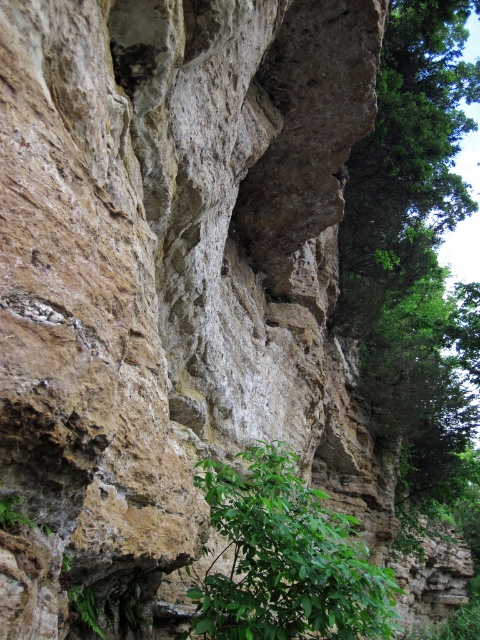
Does point (245, 580) come closer to viewer compared to point (382, 198)?

Yes, it is in front of point (382, 198).

Between green leafy plant at lower center and green leafy tree at upper right, which one has more height?

With more height is green leafy tree at upper right.

Does point (276, 637) lie in front of point (432, 3)?

Yes, point (276, 637) is closer to viewer.

Locate an element on the screen. green leafy plant at lower center is located at coordinates (285, 560).